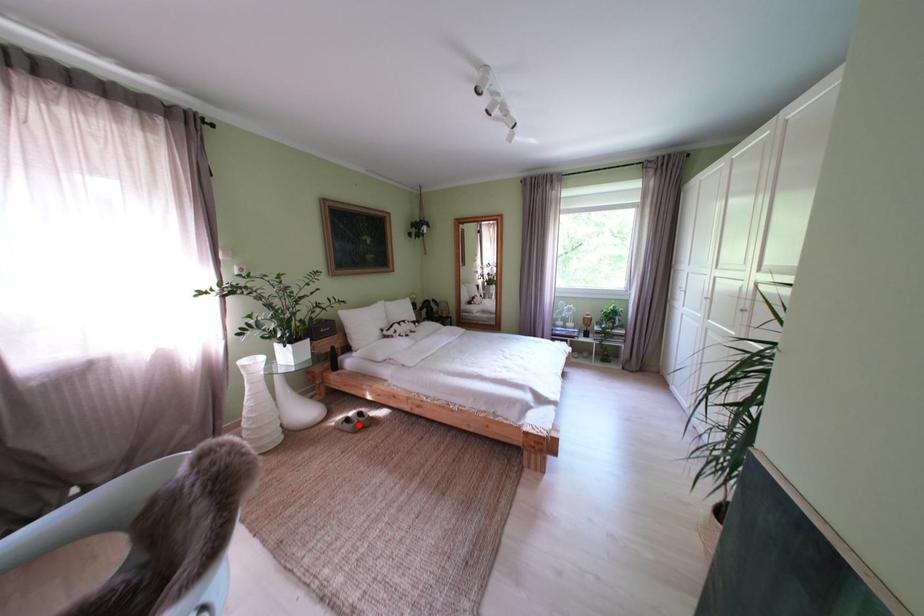
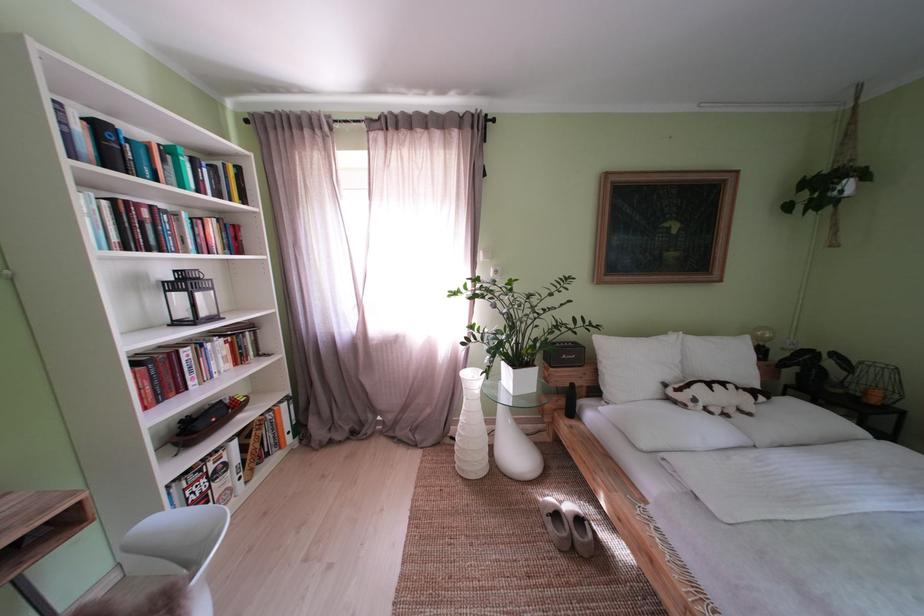
The point at the highlighted location is marked in the first image. Where is the corresponding point in the second image?

(567, 521)